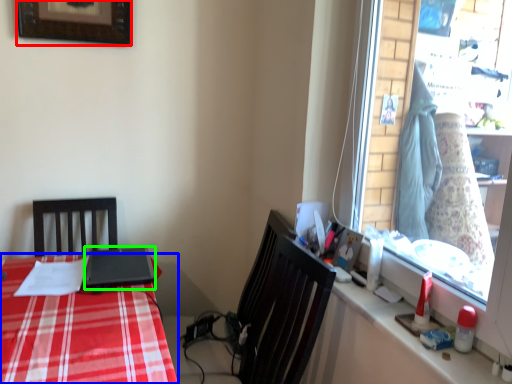
Question: Which is nearer to the picture frame (highlighted by a red box)? desk (highlighted by a blue box) or laptop (highlighted by a green box).

Choices:
 (A) desk
 (B) laptop

Answer: (B)